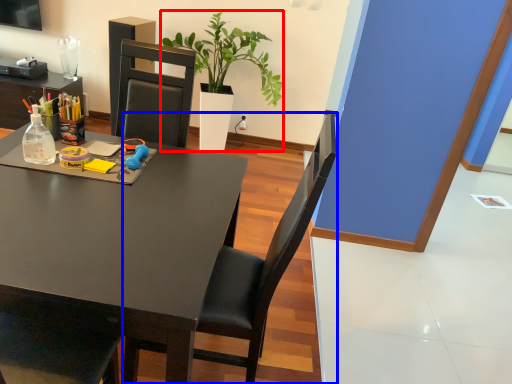
Question: Which object appears farthest to the camera in this image, houseplant (highlighted by a red box) or chair (highlighted by a blue box)?

Choices:
 (A) houseplant
 (B) chair

Answer: (A)